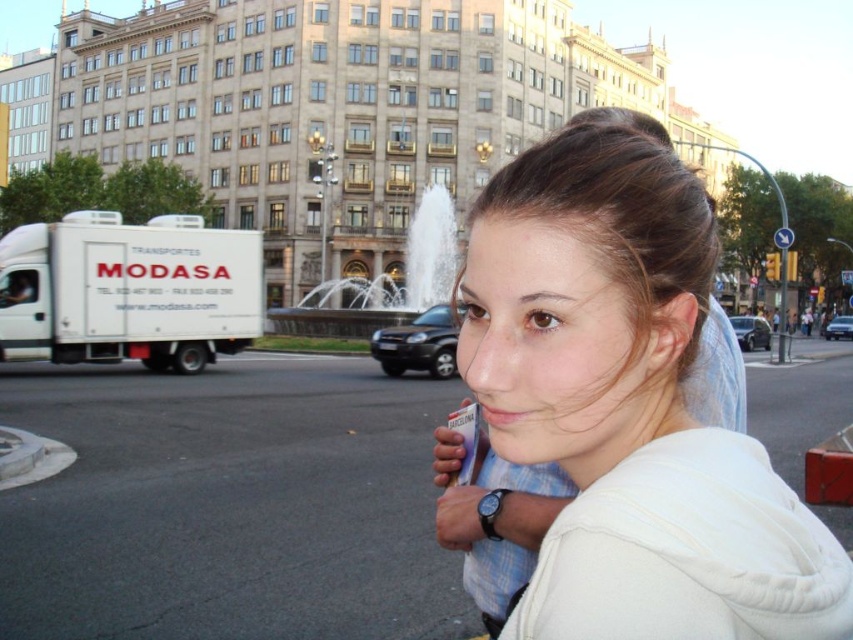
Question: Which point appears closest to the camera in this image?

Choices:
 (A) pos(521,333)
 (B) pos(714,330)

Answer: (A)

Question: Can you confirm if white cotton hoodie at center is thinner than brown smooth hair at center?

Choices:
 (A) yes
 (B) no

Answer: (A)

Question: Can you confirm if white cotton hoodie at center is positioned to the left of brown smooth hair at center?

Choices:
 (A) yes
 (B) no

Answer: (A)

Question: Which object appears closest to the camera in this image?

Choices:
 (A) white cotton hoodie at center
 (B) brown smooth hair at center

Answer: (A)

Question: Where is white cotton hoodie at center located in relation to brown smooth hair at center in the image?

Choices:
 (A) left
 (B) right

Answer: (A)

Question: Which point is farther from the camera taking this photo?

Choices:
 (A) (730, 330)
 (B) (672, 160)

Answer: (A)